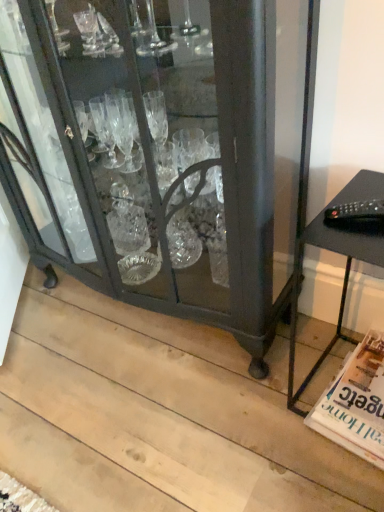
Identify the location of empty space that is ontop of white glossy magazine at lower right. (362, 389).